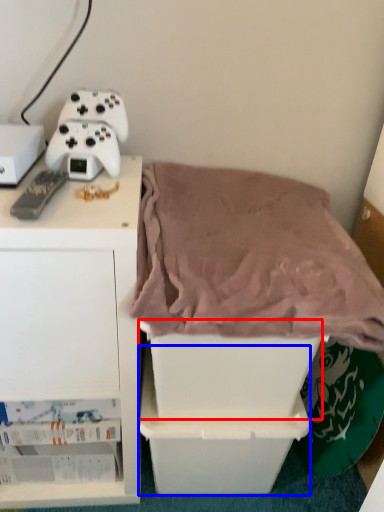
Question: Which object appears closest to the camera in this image, storage box (highlighted by a red box) or storage box (highlighted by a blue box)?

Choices:
 (A) storage box
 (B) storage box

Answer: (A)